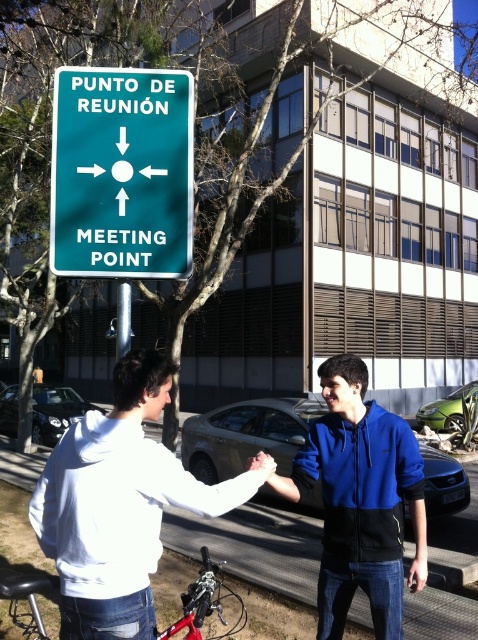
Question: Does green matte car at center have a lesser width compared to metallic pole at center?

Choices:
 (A) no
 (B) yes

Answer: (B)

Question: Estimate the real-world distances between objects in this image. Which object is closer to the green metallic sign at upper center?

Choices:
 (A) shiny black car at lower left
 (B) white hoodie at center
 (C) green matte car at center

Answer: (B)

Question: Is red matte bicycle at lower left above shiny black car at lower left?

Choices:
 (A) yes
 (B) no

Answer: (A)

Question: Does blue fleece jacket at center have a smaller size compared to metallic pole at center?

Choices:
 (A) yes
 (B) no

Answer: (A)

Question: Which point is farther from the camera taking this photo?

Choices:
 (A) (415, 412)
 (B) (443, 499)
 (C) (7, 582)

Answer: (A)

Question: Estimate the real-world distances between objects in this image. Which object is closer to the green metallic sign at upper center?

Choices:
 (A) white hoodie at center
 (B) blue fleece jacket at center

Answer: (A)